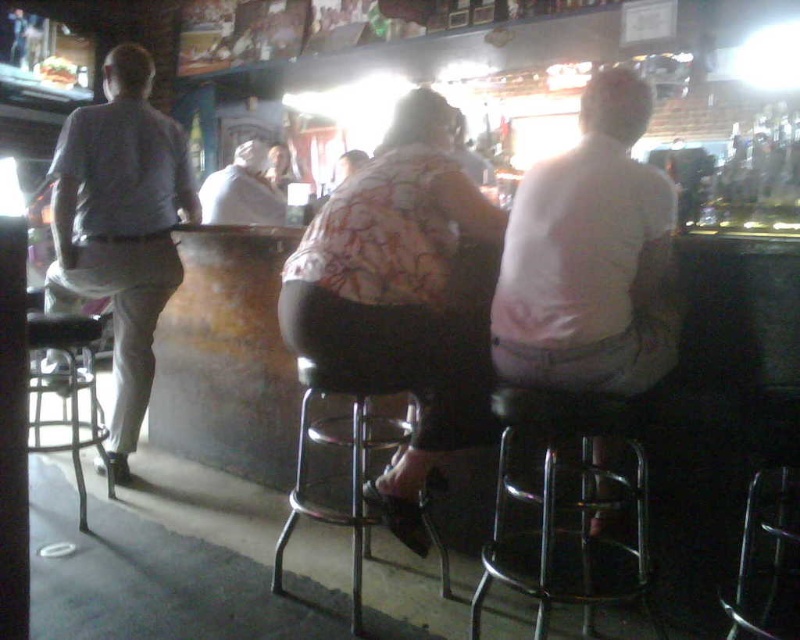
Question: Which object appears farthest from the camera in this image?

Choices:
 (A) floral fabric blouse at center
 (B) white cotton shirt at center

Answer: (B)

Question: Can you confirm if floral fabric blouse at center is positioned above metallic chrome bar stool at lower right?

Choices:
 (A) no
 (B) yes

Answer: (B)

Question: Which point is farther from the camera taking this photo?

Choices:
 (A) coord(296,458)
 (B) coord(50,324)
 (C) coord(616,180)
 (D) coord(200,188)

Answer: (D)

Question: Can you confirm if light gray fabric shirt at left is smaller than metallic silver bar stool at lower left?

Choices:
 (A) yes
 (B) no

Answer: (A)

Question: Considering the real-world distances, which object is closest to the floral fabric blouse at center?

Choices:
 (A) metallic chrome bar stool at lower right
 (B) light gray fabric shirt at left

Answer: (A)

Question: Is white matte shirt at center below metallic silver bar stool at lower center?

Choices:
 (A) no
 (B) yes

Answer: (A)